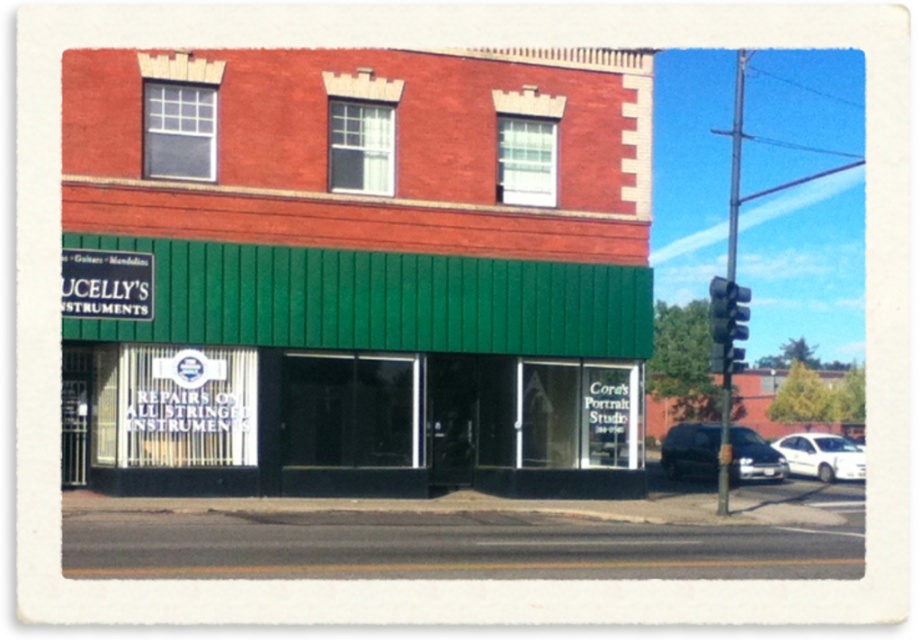
Question: Which point is farther to the camera?

Choices:
 (A) (348, 232)
 (B) (740, 285)
 (C) (137, 278)

Answer: (B)

Question: Considering the real-world distances, which object is closest to the white glossy sedan at lower right?

Choices:
 (A) white matte car at right
 (B) green plastic sign at upper left
 (C) black plastic traffic light at upper right
 (D) green woodshed at center

Answer: (A)

Question: Is white matte car at right positioned at the back of white glossy sedan at lower right?

Choices:
 (A) no
 (B) yes

Answer: (A)

Question: Which object is farther from the camera taking this photo?

Choices:
 (A) black plastic traffic light at upper right
 (B) green plastic sign at upper left
 (C) white matte car at right
 (D) white glossy sedan at lower right

Answer: (D)

Question: Is green woodshed at center thinner than green plastic sign at upper left?

Choices:
 (A) no
 (B) yes

Answer: (A)

Question: Considering the relative positions of white matte car at right and white glossy sedan at lower right in the image provided, where is white matte car at right located with respect to white glossy sedan at lower right?

Choices:
 (A) above
 (B) below

Answer: (A)